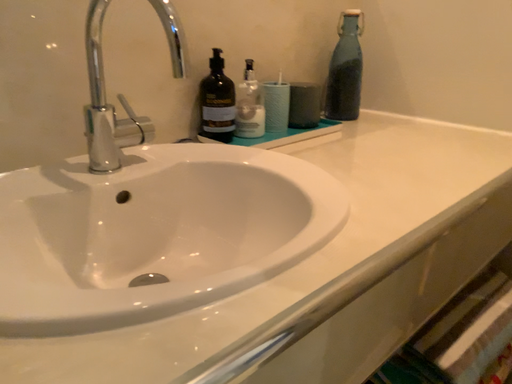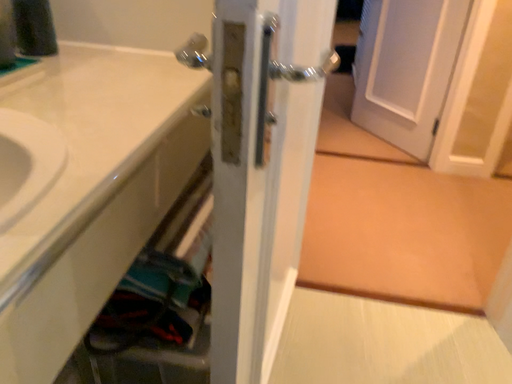
Question: How did the camera likely rotate when shooting the video?

Choices:
 (A) rotated upward
 (B) rotated downward

Answer: (B)